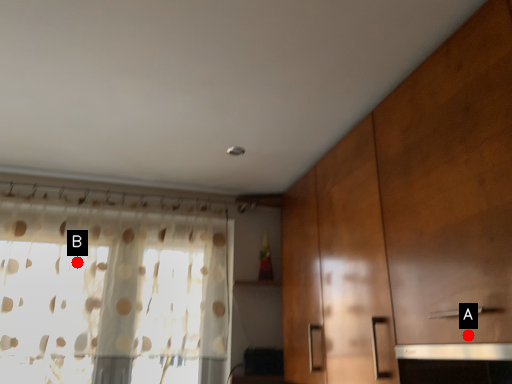
Question: Two points are circled on the image, labeled by A and B beside each circle. Which point is further to the camera?

Choices:
 (A) A is further
 (B) B is further

Answer: (B)